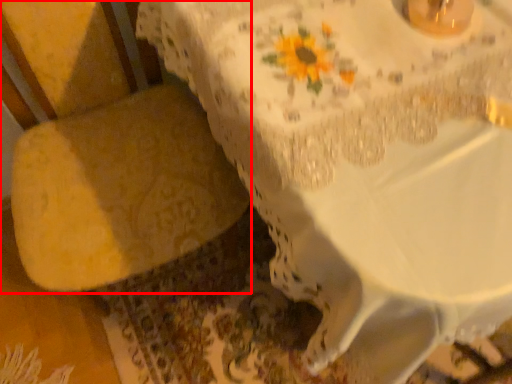
Question: From the image's perspective, what is the correct spatial relationship of armchair (annotated by the red box) in relation to table?

Choices:
 (A) below
 (B) above

Answer: (A)